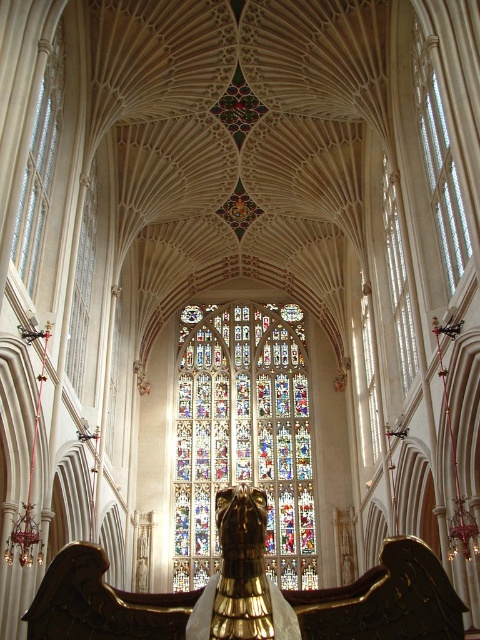
Question: Which object is farther from the camera taking this photo?

Choices:
 (A) clear glass window at right
 (B) clear glass window at upper right

Answer: (A)

Question: Is clear glass window at upper right wider than clear glass window at left?

Choices:
 (A) no
 (B) yes

Answer: (A)

Question: Which point is closer to the camera?

Choices:
 (A) (460, 220)
 (B) (383, 212)

Answer: (A)

Question: Which point is farther to the camera?

Choices:
 (A) (368, 292)
 (B) (84, 352)
 (C) (422, 140)

Answer: (A)

Question: Where is stained glass window at center located in relation to transparent stained glass at center in the image?

Choices:
 (A) left
 (B) right

Answer: (A)

Question: Does clear glass window at upper right come behind stained glass window at upper center?

Choices:
 (A) no
 (B) yes

Answer: (A)